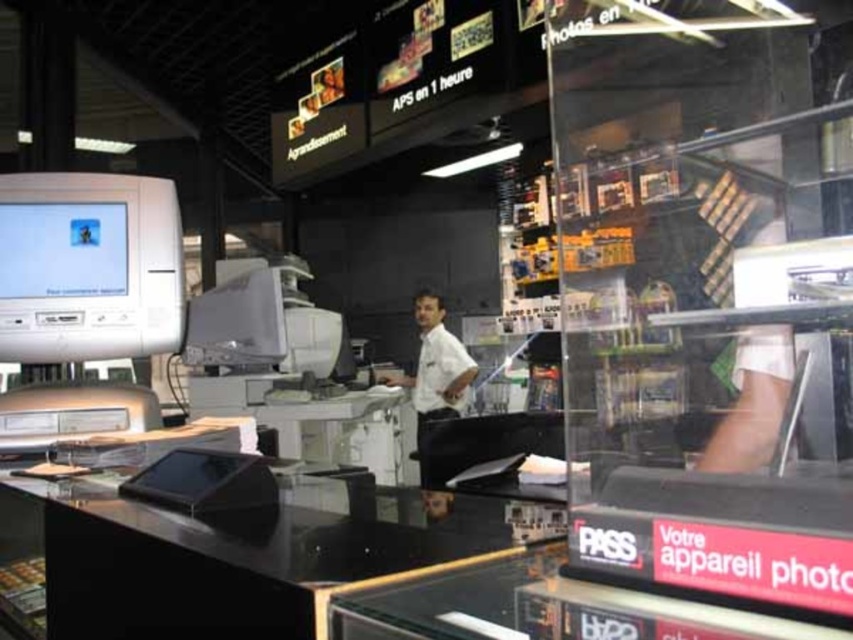
Question: Is the position of matte white monitor at upper left less distant than that of satin silver monitor at center?

Choices:
 (A) yes
 (B) no

Answer: (A)

Question: Which of the following is the farthest from the observer?

Choices:
 (A) (20, 220)
 (B) (444, 344)
 (C) (209, 308)

Answer: (B)

Question: Which object is the farthest from the satin silver monitor at center?

Choices:
 (A) white shirt at center
 (B) matte white monitor at upper left
 (C) matte white monitor at left

Answer: (A)

Question: Is matte white monitor at left wider than satin silver monitor at center?

Choices:
 (A) yes
 (B) no

Answer: (A)

Question: Which point is farther from the camera taking this photo?

Choices:
 (A) (67, 243)
 (B) (262, 330)
 (C) (140, 321)

Answer: (B)

Question: Observing the image, what is the correct spatial positioning of matte white monitor at left in reference to matte white monitor at upper left?

Choices:
 (A) left
 (B) right

Answer: (B)